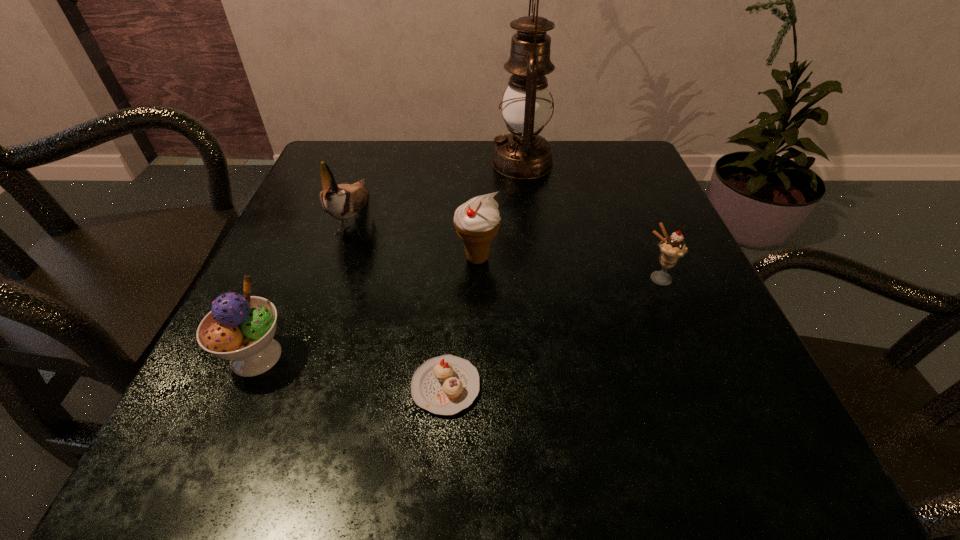
What are the coordinates of `the tallest object` in the screenshot? It's located at (523, 154).

Locate an element on the screen. Image resolution: width=960 pixels, height=540 pixels. the fifth shortest object is located at coordinates (343, 201).

This screenshot has height=540, width=960. I want to click on the fourth shortest object, so click(477, 221).

The width and height of the screenshot is (960, 540). What are the coordinates of `the tallest icecream` in the screenshot? It's located at (477, 221).

Find the location of `the nearest icecream`. the nearest icecream is located at coordinates (240, 328).

Find the location of `the rightmost icecream`. the rightmost icecream is located at coordinates (672, 248).

Locate an element on the screen. cupcake is located at coordinates point(444,385).

The width and height of the screenshot is (960, 540). I want to click on free region located 0.110m on the left of the tallest object, so click(x=444, y=164).

Identify the location of vacant space located at the face of the second tallest object. The width and height of the screenshot is (960, 540). (281, 429).

Image resolution: width=960 pixels, height=540 pixels. What are the coordinates of `vacant space located on the left of the third tallest object` in the screenshot? It's located at (403, 258).